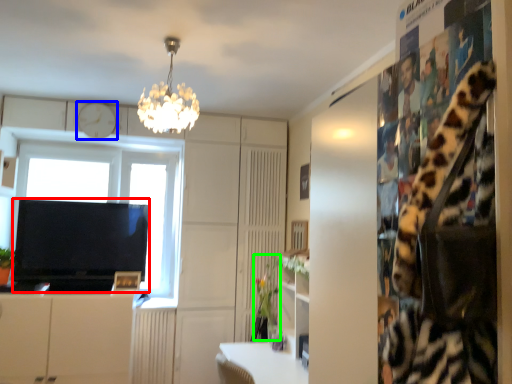
Question: Considering the real-world distances, which object is closest to television (highlighted by a red box)? clock (highlighted by a blue box) or plant (highlighted by a green box).

Choices:
 (A) clock
 (B) plant

Answer: (A)